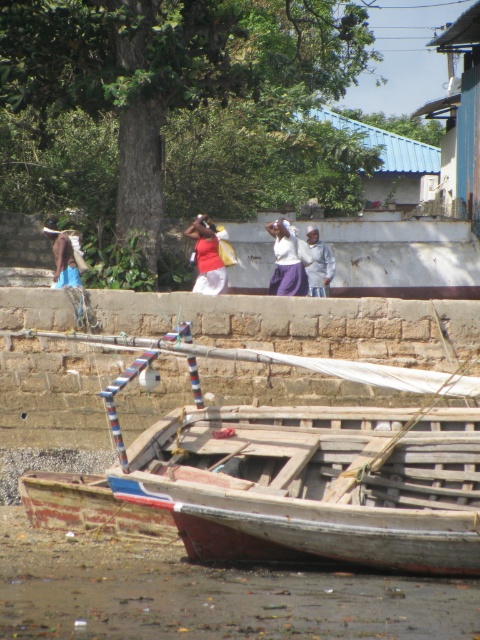
Does rusty wooden boat at lower center appear on the right side of matte red shirt at center?

Correct, you'll find rusty wooden boat at lower center to the right of matte red shirt at center.

Where is `rusty wooden boat at lower center`? rusty wooden boat at lower center is located at coordinates (292, 470).

Image resolution: width=480 pixels, height=640 pixels. I want to click on rusty wooden boat at lower center, so click(292, 470).

From the picture: Does rusty wooden boat at lower center have a smaller size compared to brown leather jacket at left?

Actually, rusty wooden boat at lower center might be larger than brown leather jacket at left.

Between point (214, 417) and point (76, 275), which one is positioned in front?

Point (214, 417) is more forward.

Who is more distant from viewer, (x=165, y=499) or (x=69, y=244)?

Point (x=69, y=244)

Find the location of a particular element. This screenshot has width=480, height=640. rusty wooden boat at lower center is located at coordinates (292, 470).

From the picture: Is white matte shirt at center positioned before gray fabric at center?

Yes, it is in front of gray fabric at center.

At what (x,y) coordinates should I click in order to perform the action: click on white matte shirt at center. Please return your answer as a coordinate pair (x, y). The height and width of the screenshot is (640, 480). Looking at the image, I should click on (286, 260).

At what (x,y) coordinates should I click in order to perform the action: click on white matte shirt at center. Please return your answer as a coordinate pair (x, y). Looking at the image, I should click on (286, 260).